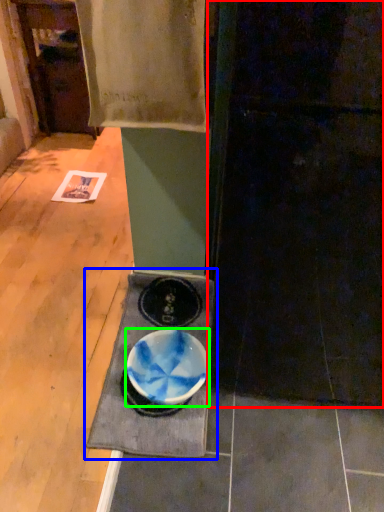
Question: Which object is the closest to the door (highlighted by a red box)? Choose among these: table (highlighted by a blue box) or bowl (highlighted by a green box).

Choices:
 (A) table
 (B) bowl

Answer: (B)